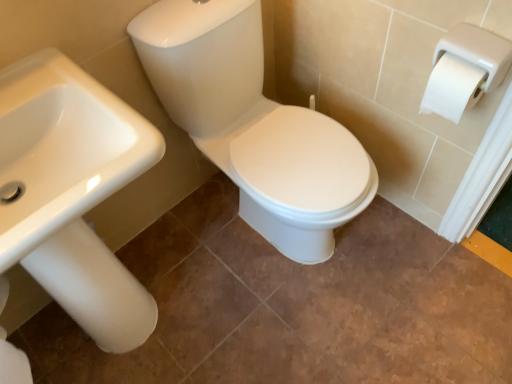
Question: Should I look upward or downward to see white glossy sink at left?

Choices:
 (A) down
 (B) up

Answer: (A)

Question: Considering the relative sizes of white glossy toilet seat at center and white glossy sink at left in the image provided, is white glossy toilet seat at center bigger than white glossy sink at left?

Choices:
 (A) no
 (B) yes

Answer: (B)

Question: Is white glossy toilet seat at center thinner than white glossy sink at left?

Choices:
 (A) yes
 (B) no

Answer: (B)

Question: Is white glossy toilet seat at center outside of white glossy sink at left?

Choices:
 (A) yes
 (B) no

Answer: (A)

Question: Are white glossy toilet seat at center and white glossy sink at left making contact?

Choices:
 (A) no
 (B) yes

Answer: (A)

Question: Is white glossy toilet seat at center taller than white glossy sink at left?

Choices:
 (A) yes
 (B) no

Answer: (B)

Question: Considering the relative positions of white glossy toilet seat at center and white glossy sink at left in the image provided, is white glossy toilet seat at center to the left of white glossy sink at left from the viewer's perspective?

Choices:
 (A) yes
 (B) no

Answer: (B)

Question: From the image's perspective, would you say white glossy sink at left is shown under white glossy toilet seat at center?

Choices:
 (A) no
 (B) yes

Answer: (B)

Question: Does white glossy sink at left appear on the left side of white glossy toilet seat at center?

Choices:
 (A) yes
 (B) no

Answer: (A)

Question: Are white glossy sink at left and white glossy toilet seat at center beside each other?

Choices:
 (A) no
 (B) yes

Answer: (A)

Question: Considering the relative sizes of white glossy sink at left and white glossy toilet seat at center in the image provided, is white glossy sink at left smaller than white glossy toilet seat at center?

Choices:
 (A) no
 (B) yes

Answer: (B)

Question: From a real-world perspective, is white glossy sink at left below white glossy toilet seat at center?

Choices:
 (A) no
 (B) yes

Answer: (A)

Question: Does white glossy sink at left have a lesser width compared to white glossy toilet seat at center?

Choices:
 (A) yes
 (B) no

Answer: (A)

Question: Considering the positions of white glossy toilet seat at center and white glossy sink at left in the image, is white glossy toilet seat at center wider or thinner than white glossy sink at left?

Choices:
 (A) wide
 (B) thin

Answer: (A)